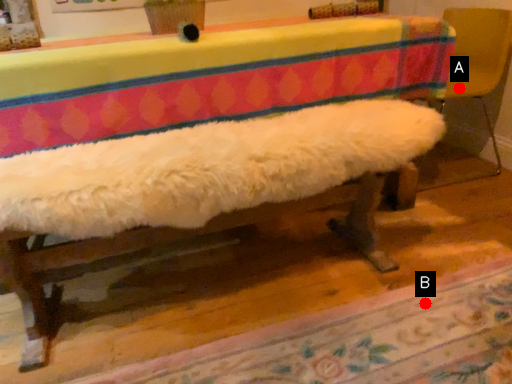
Question: Two points are circled on the image, labeled by A and B beside each circle. Which point is closer to the camera taking this photo?

Choices:
 (A) A is closer
 (B) B is closer

Answer: (B)